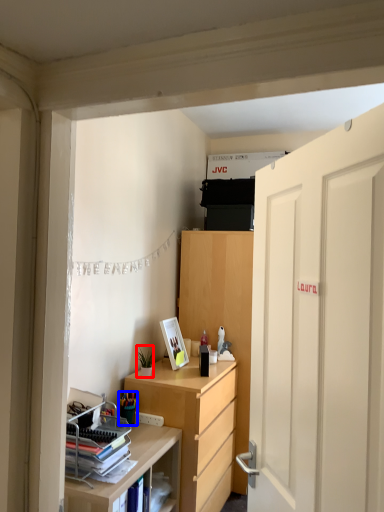
Question: Which point is closer to the camera, houseplant (highlighted by a red box) or stationery (highlighted by a blue box)?

Choices:
 (A) houseplant
 (B) stationery

Answer: (B)